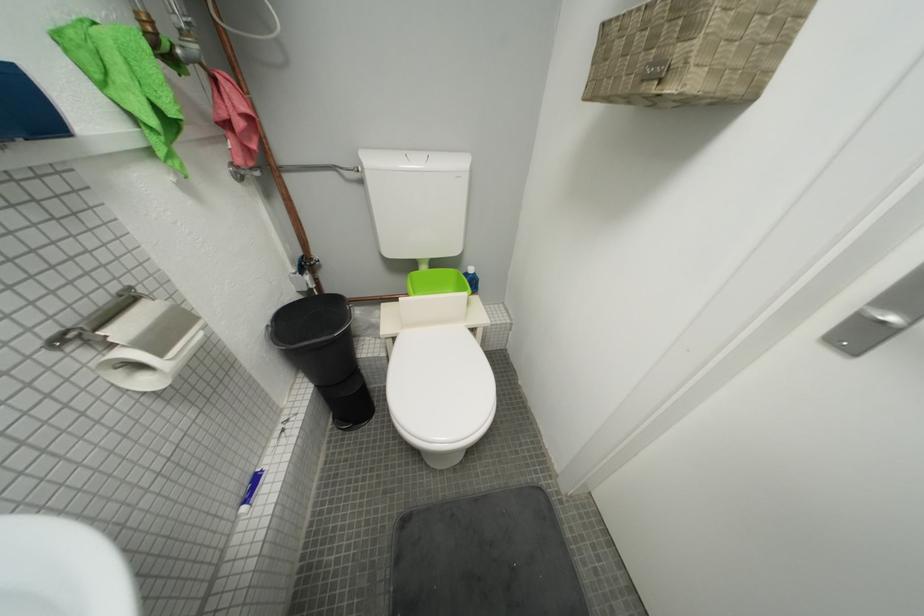
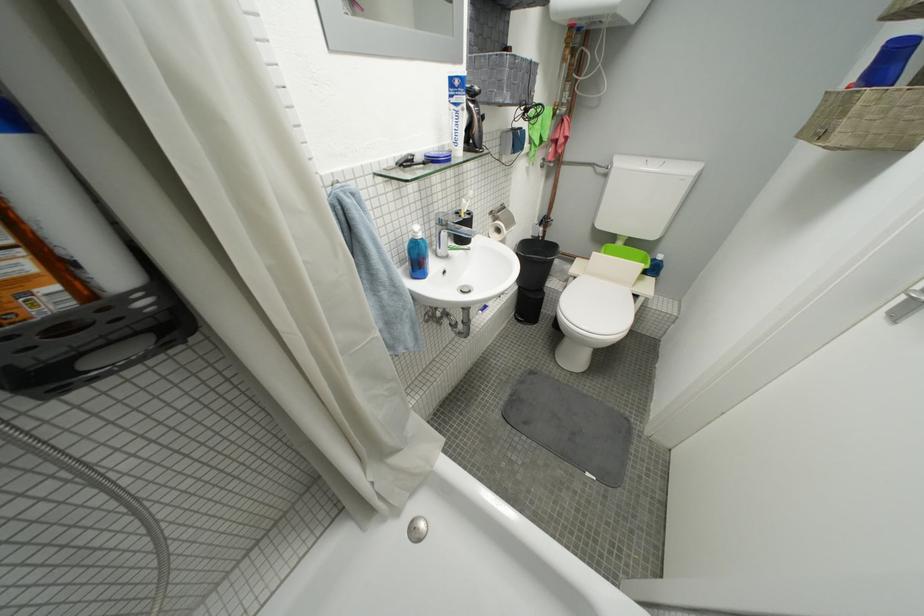
In the second image, find the point that corresponds to [403,341] in the first image.

(584, 281)